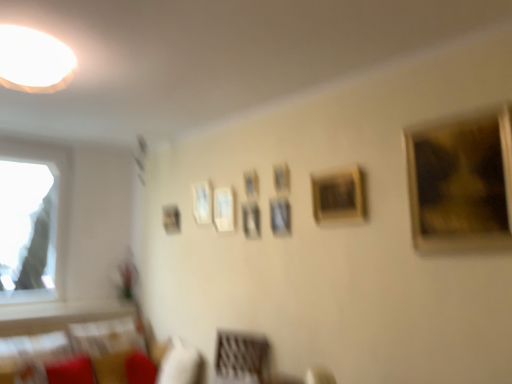
Question: From the image's perspective, is wooden frame at center, acting as the 8th picture frame starting from the back, over gold textured painting at upper right, the 9th picture frame in the back-to-front sequence?

Choices:
 (A) no
 (B) yes

Answer: (A)

Question: Is gold textured painting at upper right, the 9th picture frame in the back-to-front sequence, a part of wooden frame at center, the second picture frame when ordered from front to back?

Choices:
 (A) yes
 (B) no

Answer: (B)

Question: Can you confirm if wooden frame at center, marked as the 2th picture frame in a right-to-left arrangement, is positioned to the left of gold textured painting at upper right, the 1th picture frame positioned from the right?

Choices:
 (A) no
 (B) yes

Answer: (B)

Question: Is wooden frame at center, the second picture frame when ordered from front to back, far away from gold textured painting at upper right, the 9th picture frame in the back-to-front sequence?

Choices:
 (A) no
 (B) yes

Answer: (A)

Question: Does wooden frame at center, marked as the 2th picture frame in a right-to-left arrangement, have a larger size compared to gold textured painting at upper right, the 9th picture frame in the back-to-front sequence?

Choices:
 (A) yes
 (B) no

Answer: (B)

Question: Is wooden frame at center, the second picture frame when ordered from front to back, oriented away from gold textured painting at upper right, acting as the 1th picture frame starting from the front?

Choices:
 (A) no
 (B) yes

Answer: (A)

Question: Does velvet beige couch at lower left have a lesser width compared to wooden frame at center, marked as the 2th picture frame in a right-to-left arrangement?

Choices:
 (A) no
 (B) yes

Answer: (A)

Question: Could you tell me if velvet beige couch at lower left is turned towards wooden frame at center, marked as the 2th picture frame in a right-to-left arrangement?

Choices:
 (A) yes
 (B) no

Answer: (B)

Question: Does velvet beige couch at lower left have a larger size compared to wooden frame at center, marked as the 2th picture frame in a right-to-left arrangement?

Choices:
 (A) no
 (B) yes

Answer: (B)

Question: From a real-world perspective, is velvet beige couch at lower left located higher than wooden frame at center, marked as the 2th picture frame in a right-to-left arrangement?

Choices:
 (A) no
 (B) yes

Answer: (A)

Question: From a real-world perspective, does velvet beige couch at lower left sit lower than wooden frame at center, the second picture frame when ordered from front to back?

Choices:
 (A) yes
 (B) no

Answer: (A)

Question: Is the depth of velvet beige couch at lower left less than that of wooden frame at center, which is counted as the eighth picture frame, starting from the left?

Choices:
 (A) no
 (B) yes

Answer: (B)

Question: From a real-world perspective, is white glossy light at upper left over gold textured painting at upper right, the 9th picture frame in the back-to-front sequence?

Choices:
 (A) yes
 (B) no

Answer: (A)